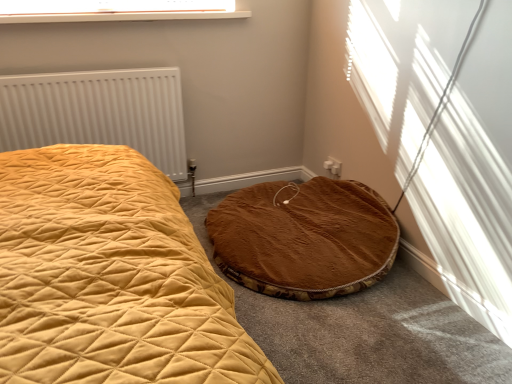
Question: Should I look upward or downward to see brown plush cat bed at lower right?

Choices:
 (A) up
 (B) down

Answer: (B)

Question: Is brown plush cat bed at lower right turned away from clear plastic window screen at upper center?

Choices:
 (A) yes
 (B) no

Answer: (B)

Question: From the image's perspective, is brown plush cat bed at lower right on clear plastic window screen at upper center?

Choices:
 (A) yes
 (B) no

Answer: (B)

Question: Considering the relative sizes of brown plush cat bed at lower right and clear plastic window screen at upper center in the image provided, is brown plush cat bed at lower right shorter than clear plastic window screen at upper center?

Choices:
 (A) yes
 (B) no

Answer: (B)

Question: Is clear plastic window screen at upper center located within brown plush cat bed at lower right?

Choices:
 (A) yes
 (B) no

Answer: (B)

Question: Is brown plush cat bed at lower right taller than clear plastic window screen at upper center?

Choices:
 (A) yes
 (B) no

Answer: (A)

Question: Is brown plush cat bed at lower right located outside clear plastic window screen at upper center?

Choices:
 (A) no
 (B) yes

Answer: (B)

Question: Can you confirm if clear plastic window screen at upper center is positioned to the left of brown plush cat bed at lower right?

Choices:
 (A) yes
 (B) no

Answer: (A)

Question: From a real-world perspective, is clear plastic window screen at upper center on brown plush cat bed at lower right?

Choices:
 (A) yes
 (B) no

Answer: (A)

Question: From a real-world perspective, is clear plastic window screen at upper center under brown plush cat bed at lower right?

Choices:
 (A) yes
 (B) no

Answer: (B)

Question: Does clear plastic window screen at upper center come in front of brown plush cat bed at lower right?

Choices:
 (A) no
 (B) yes

Answer: (A)

Question: Is clear plastic window screen at upper center completely or partially outside of brown plush cat bed at lower right?

Choices:
 (A) no
 (B) yes

Answer: (B)

Question: From the image's perspective, is clear plastic window screen at upper center located beneath brown plush cat bed at lower right?

Choices:
 (A) no
 (B) yes

Answer: (A)

Question: Is white textured radiator at left thinner than clear plastic window screen at upper center?

Choices:
 (A) yes
 (B) no

Answer: (A)